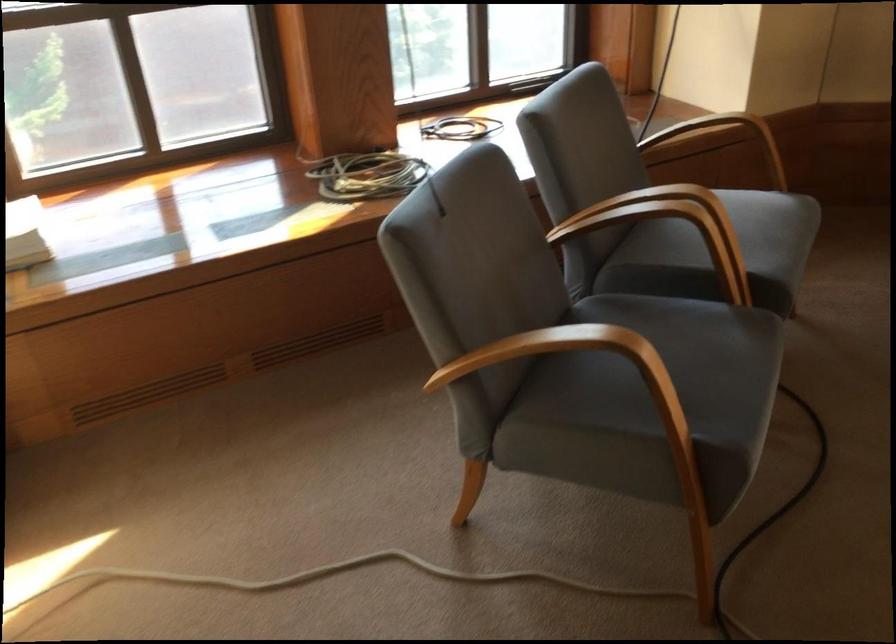
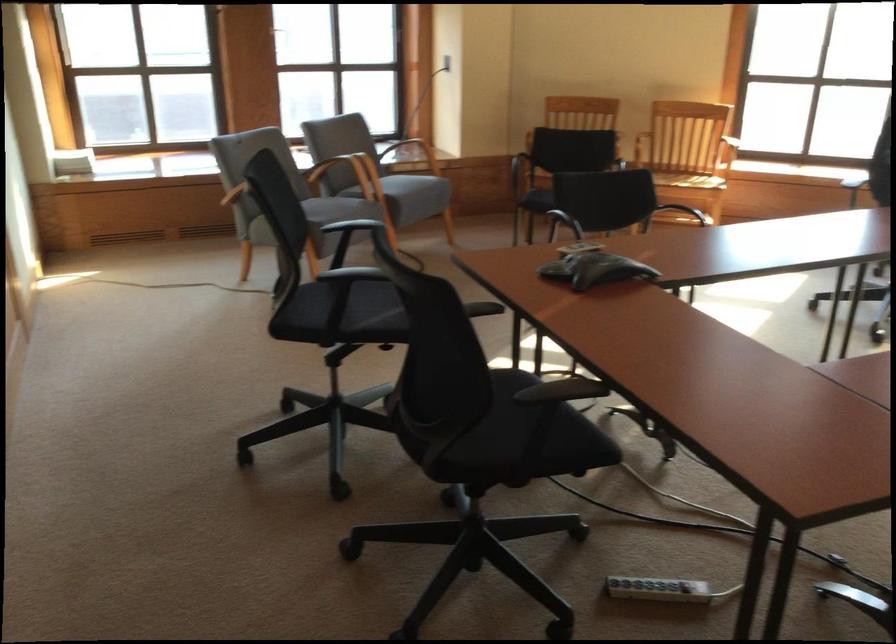
In the second image, find the point that corresponds to (x=604, y=238) in the first image.

(342, 172)